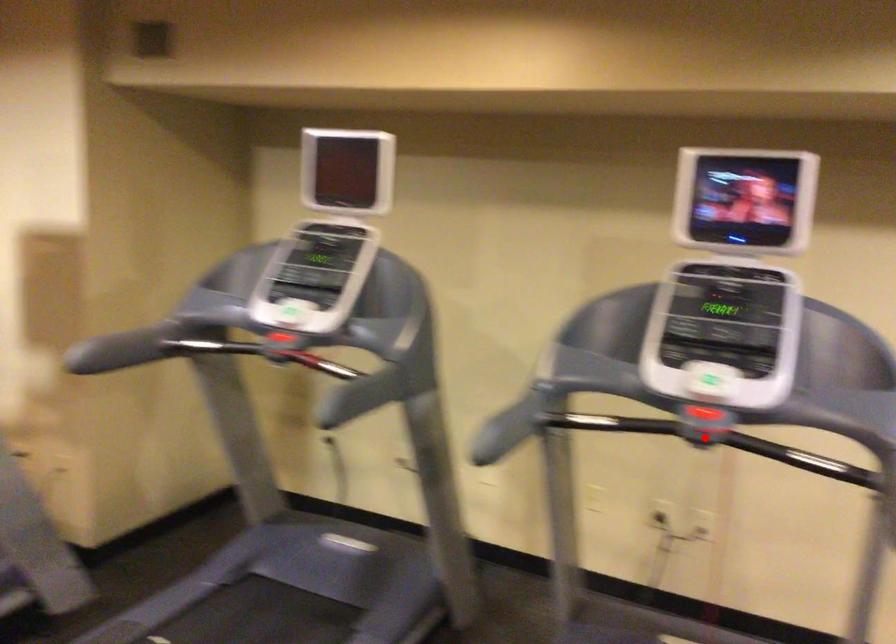
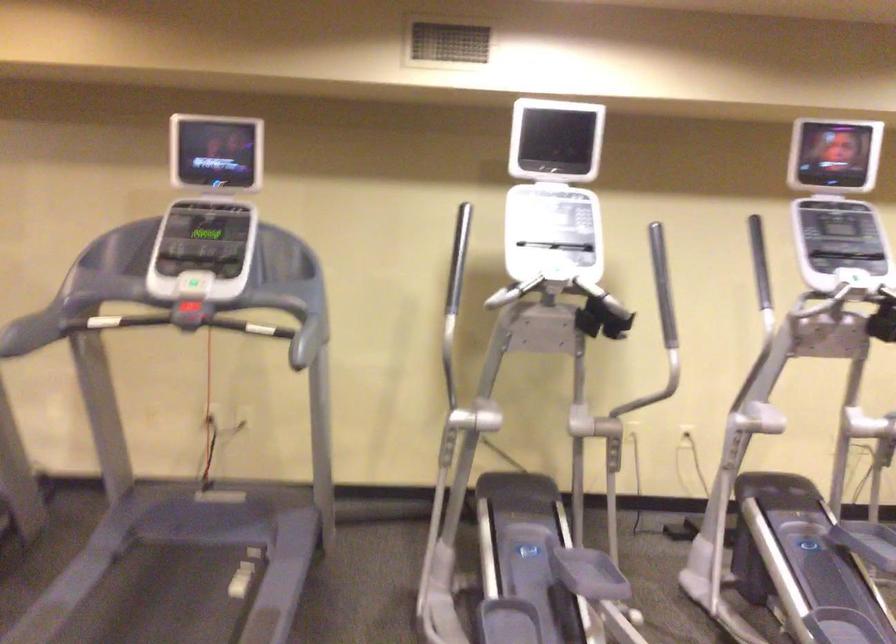
Question: A red point is marked in image1. In image2, is the corresponding 3D point closer to the camera or farther? Reply with the corresponding letter.

Choices:
 (A) The corresponding 3D point is closer.
 (B) The corresponding 3D point is farther.

Answer: (B)